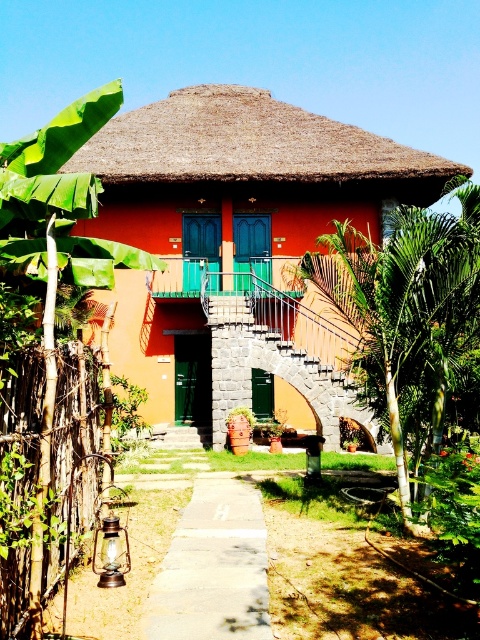
Question: Which object appears closest to the camera in this image?

Choices:
 (A) gray concrete path at center
 (B) stone/stucco staircase at center
 (C) matte orange hut at center
 (D) green leafy tree at center

Answer: (D)

Question: In this image, where is green leafy tree at center located relative to gray concrete path at center?

Choices:
 (A) left
 (B) right

Answer: (B)

Question: Among these points, which one is nearest to the camera?

Choices:
 (A) (38, 272)
 (B) (393, 444)
 (C) (260, 349)
 (D) (180, 636)

Answer: (D)

Question: Considering the relative positions of green leafy tree at center and stone/stucco staircase at center in the image provided, where is green leafy tree at center located with respect to stone/stucco staircase at center?

Choices:
 (A) left
 (B) right

Answer: (B)

Question: Where is green leafy tree at center located in relation to gray concrete path at center in the image?

Choices:
 (A) right
 (B) left

Answer: (A)

Question: Based on their relative distances, which object is nearer to the matte orange hut at center?

Choices:
 (A) stone/stucco staircase at center
 (B) green leafy tree at center
 (C) gray concrete path at center
 (D) green leafy plant at left

Answer: (A)